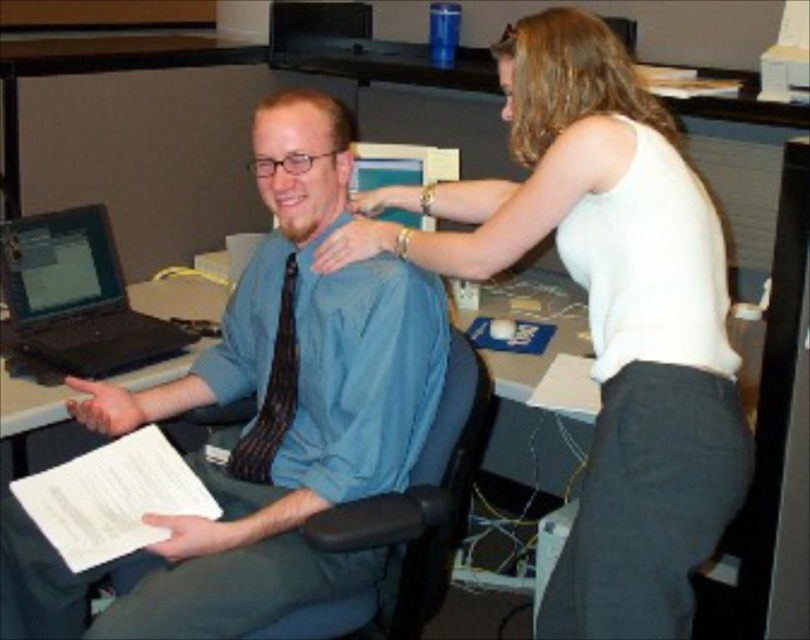
You are a delivery person who needs to place a 21 inch long package between the black matte laptop at left and the striped fabric tie at center. Can you fit the package in that space?

The distance between the black matte laptop at left and the striped fabric tie at center is 20.99 inches. Since the package is 21 inches long, it is slightly longer than the available space. Therefore, the package cannot fit between them.

In the scene shown: You are an office worker who needs to determine which object takes up more space in the image. Which one is bigger between the white fabric shirt at upper right and the black matte laptop at left?

The white fabric shirt at upper right is larger in size than the black matte laptop at left, so the white fabric shirt at upper right takes up more space in the image.